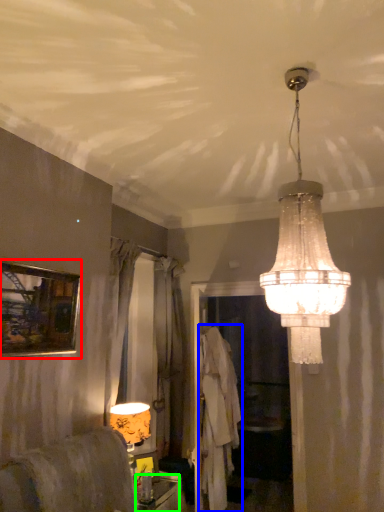
Question: Which is farther away from picture frame (highlighted by a red box)? robe (highlighted by a blue box) or furniture (highlighted by a green box)?

Choices:
 (A) robe
 (B) furniture

Answer: (A)